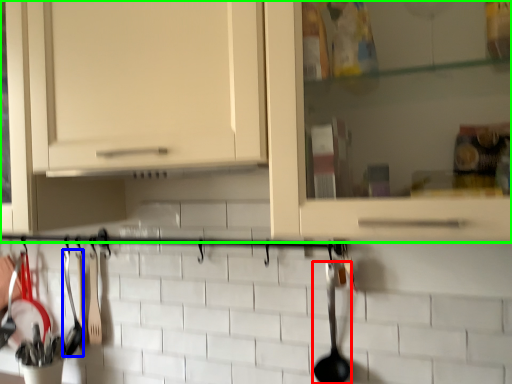
Question: Estimate the real-world distances between objects in this image. Which object is closer to silverware (highlighted by a red box), silverware (highlighted by a blue box) or cabinetry (highlighted by a green box)?

Choices:
 (A) silverware
 (B) cabinetry

Answer: (B)